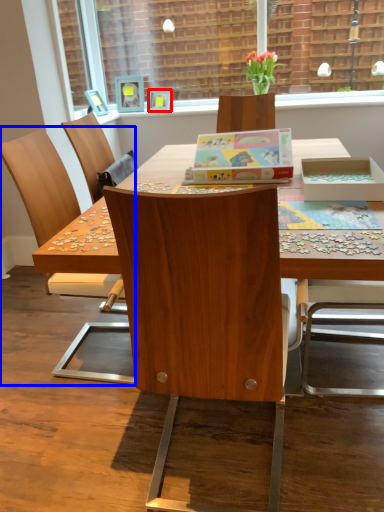
Question: Which of the following is the farthest to the observer, picture frame (highlighted by a red box) or chair (highlighted by a blue box)?

Choices:
 (A) picture frame
 (B) chair

Answer: (A)